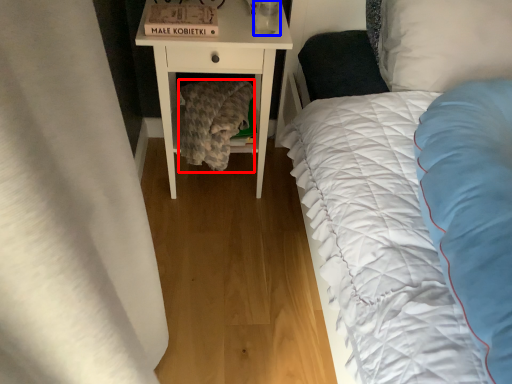
Question: Which object is further to the camera taking this photo, blanket (highlighted by a red box) or glass vase (highlighted by a blue box)?

Choices:
 (A) blanket
 (B) glass vase

Answer: (A)